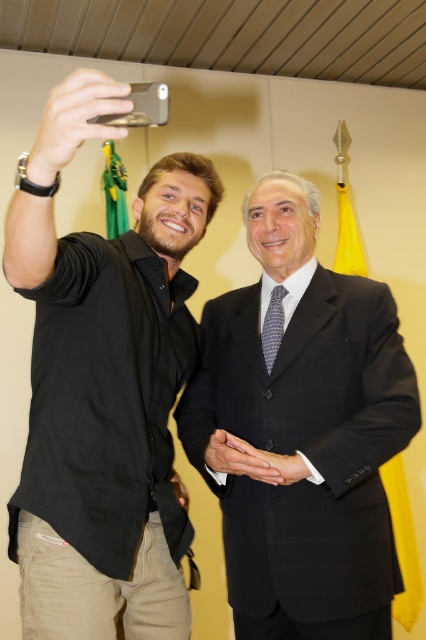
In the scene shown: Is matte black suit at center taller than blue dotted tie at center?

Yes.

At what (x,y) coordinates should I click in order to perform the action: click on matte black suit at center. Please return your answer as a coordinate pair (x, y). The image size is (426, 640). Looking at the image, I should click on (302, 433).

Locate an element on the screen. Image resolution: width=426 pixels, height=640 pixels. matte black suit at center is located at coordinates point(302,433).

Which of these two, black matte shirt at left or blue dotted tie at center, stands taller?

black matte shirt at left is taller.

What do you see at coordinates (108, 404) in the screenshot? The height and width of the screenshot is (640, 426). I see `black matte shirt at left` at bounding box center [108, 404].

Locate an element on the screen. Image resolution: width=426 pixels, height=640 pixels. black matte shirt at left is located at coordinates (108, 404).

Can you confirm if black matte shirt at left is wider than matte black suit at center?

No, black matte shirt at left is not wider than matte black suit at center.

Is point (135, 211) positioned after point (192, 436)?

No.

Identify the location of black matte shirt at left. The height and width of the screenshot is (640, 426). (108, 404).